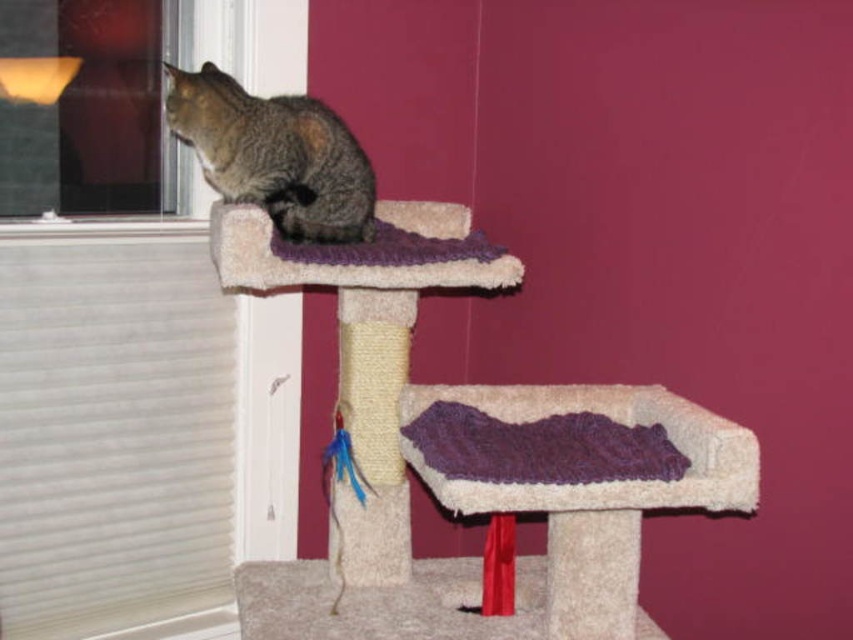
Question: Which object is the closest to the transparent glass window at upper left?

Choices:
 (A) tabby fur cat at left
 (B) beige carpeted stool at center

Answer: (A)

Question: Is the position of beige carpeted stool at center less distant than that of tabby fur cat at left?

Choices:
 (A) no
 (B) yes

Answer: (B)

Question: Is beige carpeted stool at center above tabby fur cat at left?

Choices:
 (A) yes
 (B) no

Answer: (B)

Question: Which object is positioned farthest from the beige carpeted stool at center?

Choices:
 (A) tabby fur cat at left
 (B) transparent glass window at upper left

Answer: (B)

Question: Does beige carpeted stool at center lie in front of transparent glass window at upper left?

Choices:
 (A) no
 (B) yes

Answer: (B)

Question: Which point is farther from the camera taking this photo?

Choices:
 (A) (209, 173)
 (B) (143, 44)

Answer: (B)